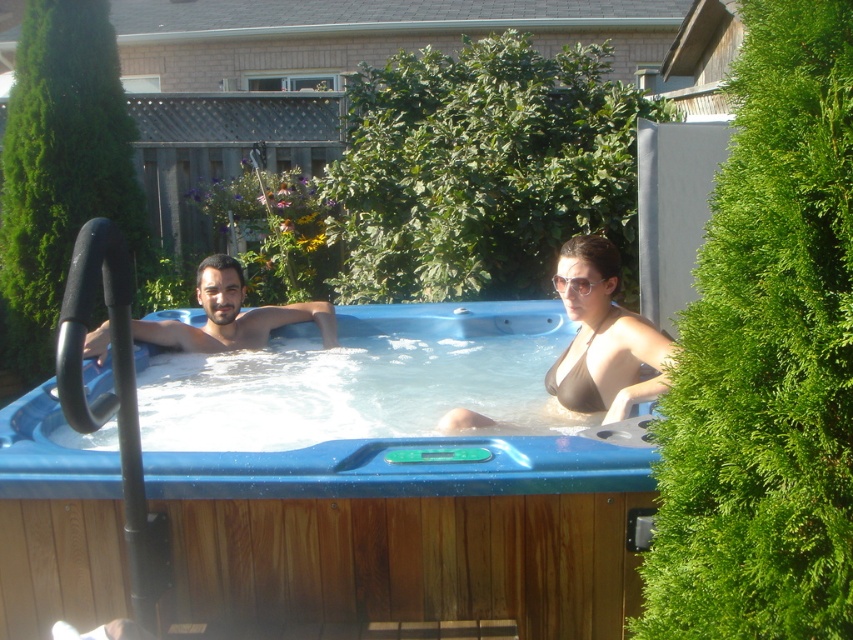
You are standing at the origin point in the backyard. The blue wood hot tub at center is located at coordinates 0.833 on the x axis and 0.479 on the y axis. If you want to walk directly to the hot tub, in which direction should you move?

To reach the blue wood hot tub at center located at coordinates x 0.833 and y 0.479, you should move northeast since both the x and y values are positive and greater than zero.

You are planning to install a safety railing around the hot tub. Based on the image, which object should the railing be placed closer to, the brown bikini top at center or the matte black man at left?

The brown bikini top at center is located below the matte black man at left, so the railing should be placed closer to the matte black man at left to ensure safety around the hot tub.

In the scene shown: You are planning to install a new lighting system around the blue wood hot tub at center and the matte black man at left. Based on their positions, which object should you place the lights closer to the ground?

The blue wood hot tub at center should have lights placed closer to the ground because it is located below the matte black man at left.